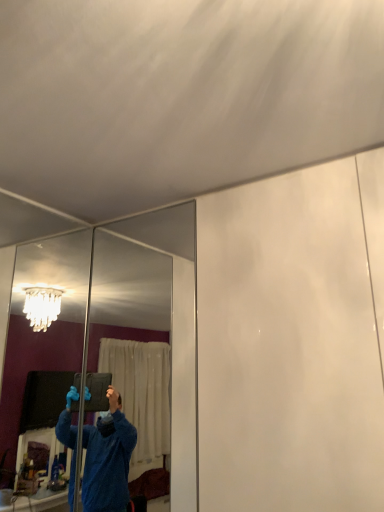
Question: Should I look upward or downward to see clear glass mirror at left, positioned as the 2th mirror in right-to-left order?

Choices:
 (A) down
 (B) up

Answer: (A)

Question: Does clear glass mirror at left, positioned as the 2th mirror in right-to-left order, have a lesser height compared to clear glass mirror at center, arranged as the second mirror when viewed from the left?

Choices:
 (A) yes
 (B) no

Answer: (B)

Question: Is clear glass mirror at left, positioned as the 2th mirror in right-to-left order, to the left of clear glass mirror at center, the first mirror when ordered from right to left, from the viewer's perspective?

Choices:
 (A) yes
 (B) no

Answer: (A)

Question: Is clear glass mirror at left, positioned as the 2th mirror in right-to-left order, positioned behind clear glass mirror at center, the first mirror when ordered from right to left?

Choices:
 (A) yes
 (B) no

Answer: (B)

Question: From the image's perspective, does clear glass mirror at left, the 1th mirror in the left-to-right sequence, appear higher than clear glass mirror at center, arranged as the second mirror when viewed from the left?

Choices:
 (A) yes
 (B) no

Answer: (A)

Question: Does clear glass mirror at left, positioned as the 2th mirror in right-to-left order, have a greater width compared to clear glass mirror at center, arranged as the second mirror when viewed from the left?

Choices:
 (A) no
 (B) yes

Answer: (A)

Question: From the image's perspective, is clear glass mirror at left, positioned as the 2th mirror in right-to-left order, beneath clear glass mirror at center, arranged as the second mirror when viewed from the left?

Choices:
 (A) no
 (B) yes

Answer: (A)

Question: Considering the relative sizes of clear glass mirror at center, arranged as the second mirror when viewed from the left, and clear glass mirror at left, the 1th mirror in the left-to-right sequence, in the image provided, is clear glass mirror at center, arranged as the second mirror when viewed from the left, bigger than clear glass mirror at left, the 1th mirror in the left-to-right sequence,?

Choices:
 (A) no
 (B) yes

Answer: (B)

Question: Does clear glass mirror at center, arranged as the second mirror when viewed from the left, have a lesser width compared to clear glass mirror at left, the 1th mirror in the left-to-right sequence?

Choices:
 (A) yes
 (B) no

Answer: (B)

Question: From the image's perspective, does clear glass mirror at center, the first mirror when ordered from right to left, appear higher than clear glass mirror at left, the 1th mirror in the left-to-right sequence?

Choices:
 (A) yes
 (B) no

Answer: (B)

Question: Does clear glass mirror at center, the first mirror when ordered from right to left, come behind clear glass mirror at left, the 1th mirror in the left-to-right sequence?

Choices:
 (A) no
 (B) yes

Answer: (B)

Question: Is clear glass mirror at center, arranged as the second mirror when viewed from the left, facing away from clear glass mirror at left, positioned as the 2th mirror in right-to-left order?

Choices:
 (A) yes
 (B) no

Answer: (B)

Question: Considering the relative sizes of clear glass mirror at center, arranged as the second mirror when viewed from the left, and clear glass mirror at left, the 1th mirror in the left-to-right sequence, in the image provided, is clear glass mirror at center, arranged as the second mirror when viewed from the left, shorter than clear glass mirror at left, the 1th mirror in the left-to-right sequence,?

Choices:
 (A) yes
 (B) no

Answer: (A)

Question: Choose the correct answer: Is clear glass mirror at left, the 1th mirror in the left-to-right sequence, inside clear glass mirror at center, the first mirror when ordered from right to left, or outside it?

Choices:
 (A) outside
 (B) inside

Answer: (A)